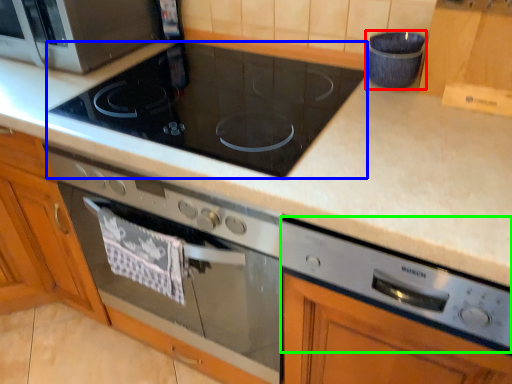
Question: Which object is positioned closest to appliance (highlighted by a red box)? Select from gas stove (highlighted by a blue box) and appliance (highlighted by a green box).

Choices:
 (A) gas stove
 (B) appliance

Answer: (A)